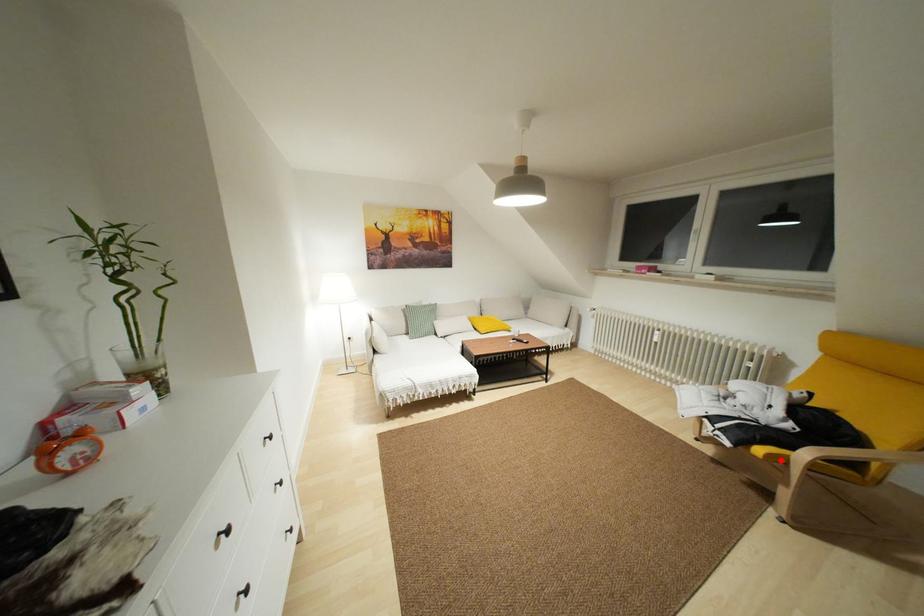
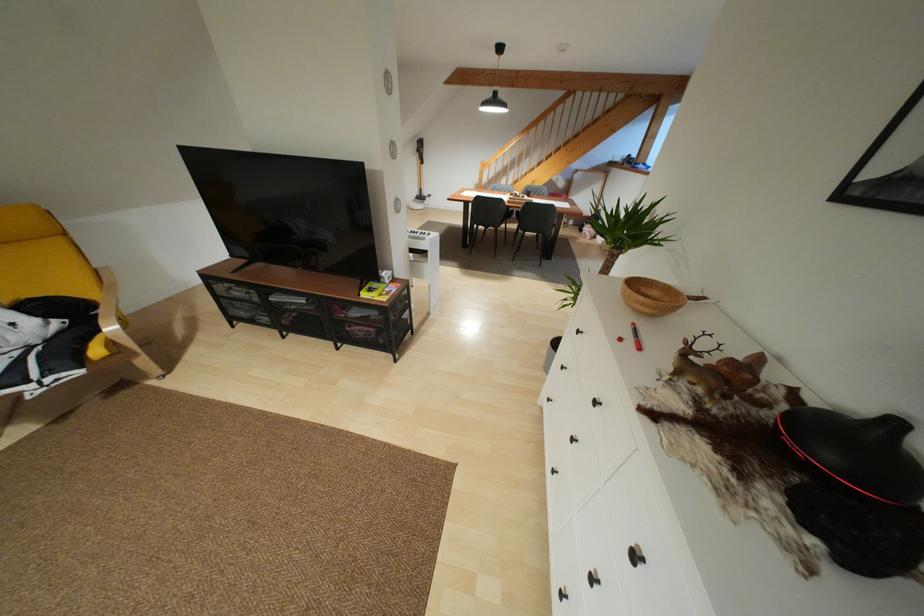
The point at the highlighted location is marked in the first image. Where is the corresponding point in the second image?

(111, 344)